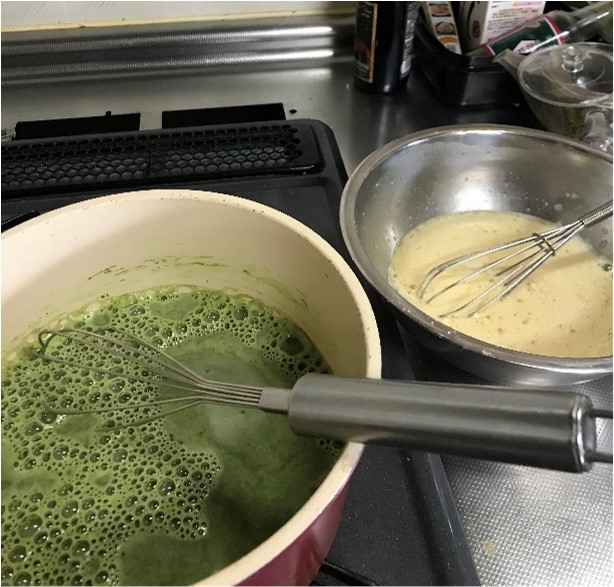
The width and height of the screenshot is (614, 587). What are the coordinates of `bowl rims` in the screenshot? It's located at (336, 505), (575, 369).